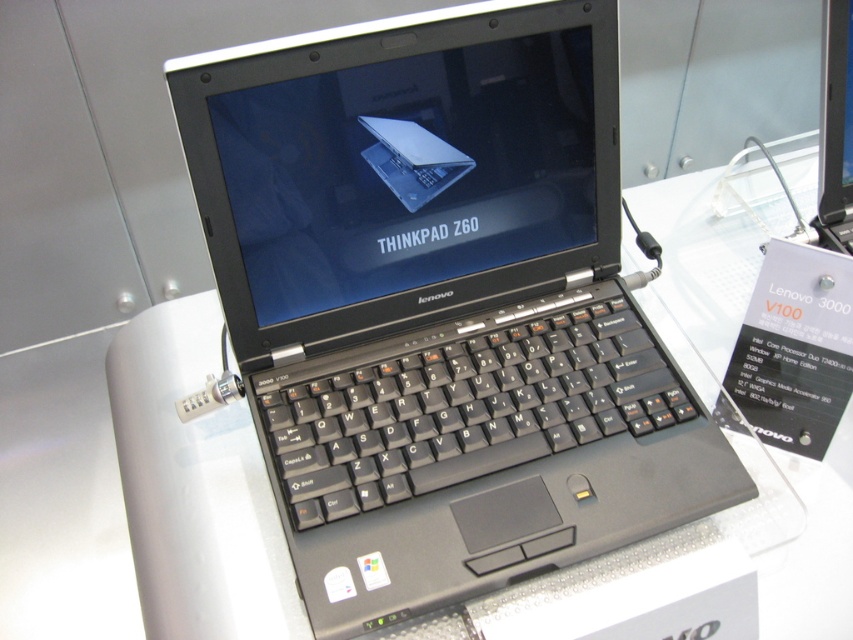
Question: Is black plastic laptop at center wider than sleek silver laptop at center?

Choices:
 (A) no
 (B) yes

Answer: (B)

Question: Considering the relative positions of black plastic laptop at center and sleek silver laptop at center in the image provided, where is black plastic laptop at center located with respect to sleek silver laptop at center?

Choices:
 (A) right
 (B) left

Answer: (A)

Question: Among these objects, which one is nearest to the camera?

Choices:
 (A) black plastic laptop at center
 (B) sleek silver laptop at center

Answer: (A)

Question: Does black plastic laptop at center have a lesser width compared to sleek silver laptop at center?

Choices:
 (A) yes
 (B) no

Answer: (B)